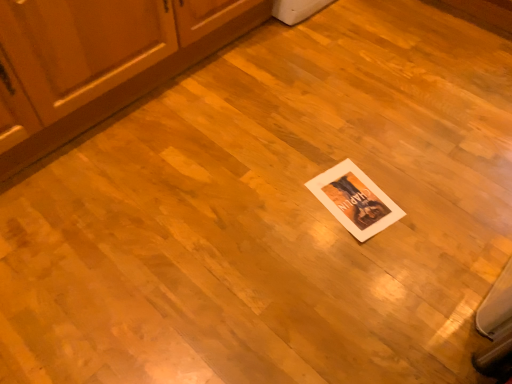
Question: Should I look upward or downward to see wooden cabinet at lower left?

Choices:
 (A) up
 (B) down

Answer: (A)